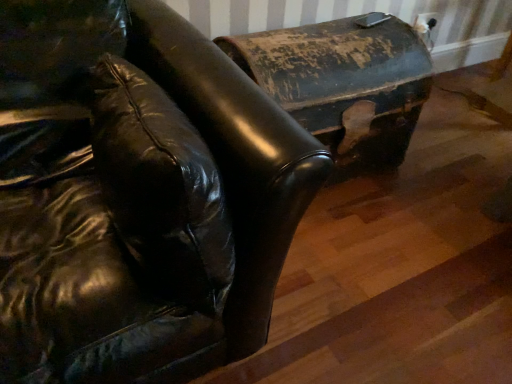
Question: Which direction should I rotate to face shiny black leather couch at center, which is the second furniture from right to left, — up or down?

Choices:
 (A) up
 (B) down

Answer: (A)

Question: Considering the relative sizes of rusty metal trunk at upper right, acting as the 1th furniture starting from the right, and shiny black leather couch at center, marked as the 1th furniture in a left-to-right arrangement, in the image provided, is rusty metal trunk at upper right, acting as the 1th furniture starting from the right, wider than shiny black leather couch at center, marked as the 1th furniture in a left-to-right arrangement,?

Choices:
 (A) yes
 (B) no

Answer: (B)

Question: Considering the relative sizes of rusty metal trunk at upper right, acting as the 1th furniture starting from the right, and shiny black leather couch at center, which is the second furniture from right to left, in the image provided, is rusty metal trunk at upper right, acting as the 1th furniture starting from the right, smaller than shiny black leather couch at center, which is the second furniture from right to left,?

Choices:
 (A) no
 (B) yes

Answer: (B)

Question: Is rusty metal trunk at upper right, acting as the 1th furniture starting from the right, far away from shiny black leather couch at center, which is the second furniture from right to left?

Choices:
 (A) no
 (B) yes

Answer: (A)

Question: From a real-world perspective, does rusty metal trunk at upper right, acting as the 1th furniture starting from the right, sit lower than shiny black leather couch at center, which is the second furniture from right to left?

Choices:
 (A) yes
 (B) no

Answer: (A)

Question: Does rusty metal trunk at upper right, arranged as the second furniture when viewed from the left, have a larger size compared to shiny black leather couch at center, marked as the 1th furniture in a left-to-right arrangement?

Choices:
 (A) no
 (B) yes

Answer: (A)

Question: Is the position of rusty metal trunk at upper right, arranged as the second furniture when viewed from the left, more distant than that of shiny black leather couch at center, which is the second furniture from right to left?

Choices:
 (A) yes
 (B) no

Answer: (A)

Question: Does shiny black leather couch at center, which is the second furniture from right to left, touch rusty metal trunk at upper right, acting as the 1th furniture starting from the right?

Choices:
 (A) yes
 (B) no

Answer: (B)

Question: Is shiny black leather couch at center, which is the second furniture from right to left, to the right of rusty metal trunk at upper right, arranged as the second furniture when viewed from the left, from the viewer's perspective?

Choices:
 (A) yes
 (B) no

Answer: (B)

Question: Is shiny black leather couch at center, which is the second furniture from right to left, bigger than rusty metal trunk at upper right, arranged as the second furniture when viewed from the left?

Choices:
 (A) yes
 (B) no

Answer: (A)

Question: Does shiny black leather couch at center, which is the second furniture from right to left, have a smaller size compared to rusty metal trunk at upper right, arranged as the second furniture when viewed from the left?

Choices:
 (A) no
 (B) yes

Answer: (A)

Question: Does shiny black leather couch at center, which is the second furniture from right to left, appear on the left side of rusty metal trunk at upper right, arranged as the second furniture when viewed from the left?

Choices:
 (A) yes
 (B) no

Answer: (A)

Question: Are shiny black leather couch at center, marked as the 1th furniture in a left-to-right arrangement, and rusty metal trunk at upper right, arranged as the second furniture when viewed from the left, far apart?

Choices:
 (A) no
 (B) yes

Answer: (A)

Question: Considering the relative positions of rusty metal trunk at upper right, acting as the 1th furniture starting from the right, and shiny black leather couch at center, which is the second furniture from right to left, in the image provided, is rusty metal trunk at upper right, acting as the 1th furniture starting from the right, to the left or to the right of shiny black leather couch at center, which is the second furniture from right to left,?

Choices:
 (A) left
 (B) right

Answer: (B)